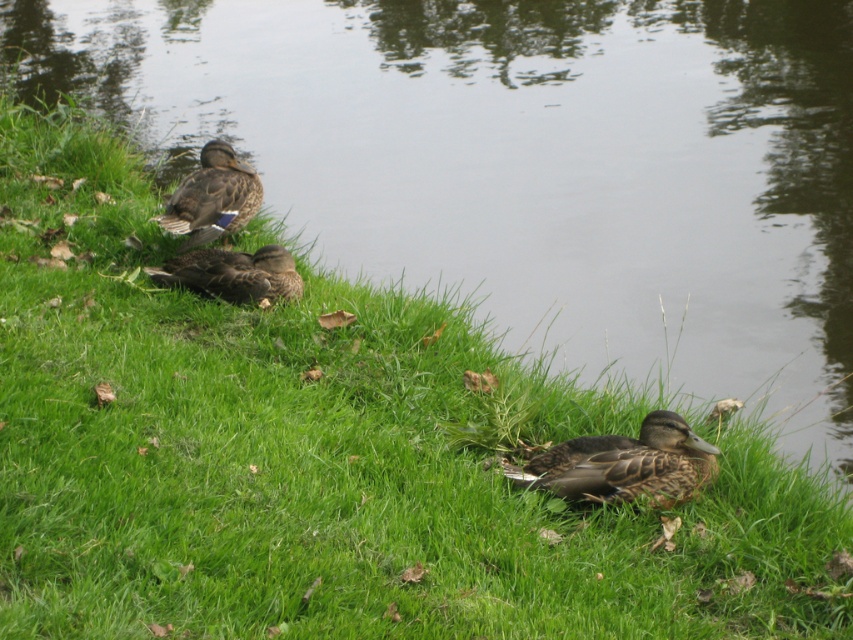
Does brown speckled duck at center have a smaller size compared to brown matte duck at center?

Yes.

Does point (648, 502) lie behind point (215, 262)?

No.

Where is `brown speckled duck at center`? The height and width of the screenshot is (640, 853). brown speckled duck at center is located at coordinates (625, 465).

What do you see at coordinates (625, 465) in the screenshot? Image resolution: width=853 pixels, height=640 pixels. I see `brown speckled duck at center` at bounding box center [625, 465].

Does brown speckled duck at center appear on the right side of brown feathered duck at upper left?

Indeed, brown speckled duck at center is positioned on the right side of brown feathered duck at upper left.

Measure the distance between point (714, 467) and camera.

16.29 feet

This screenshot has height=640, width=853. Find the location of `brown speckled duck at center`. brown speckled duck at center is located at coordinates (625, 465).

Does brown feathered duck at upper left have a greater height compared to brown matte duck at center?

Indeed, brown feathered duck at upper left has a greater height compared to brown matte duck at center.

Who is taller, brown feathered duck at upper left or brown matte duck at center?

Standing taller between the two is brown feathered duck at upper left.

Which is in front, point (213, 208) or point (273, 273)?

Point (273, 273) is in front.

Identify the location of brown feathered duck at upper left. (212, 196).